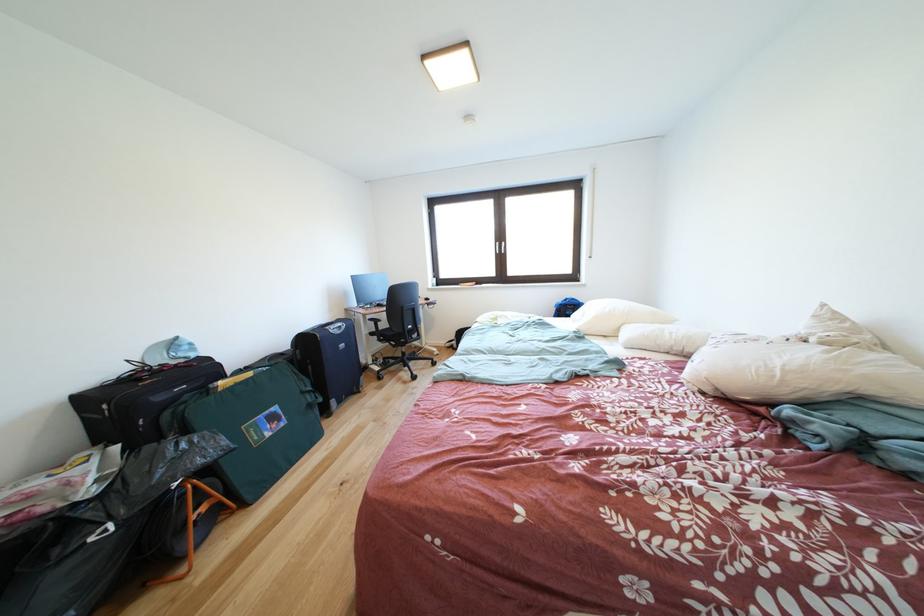
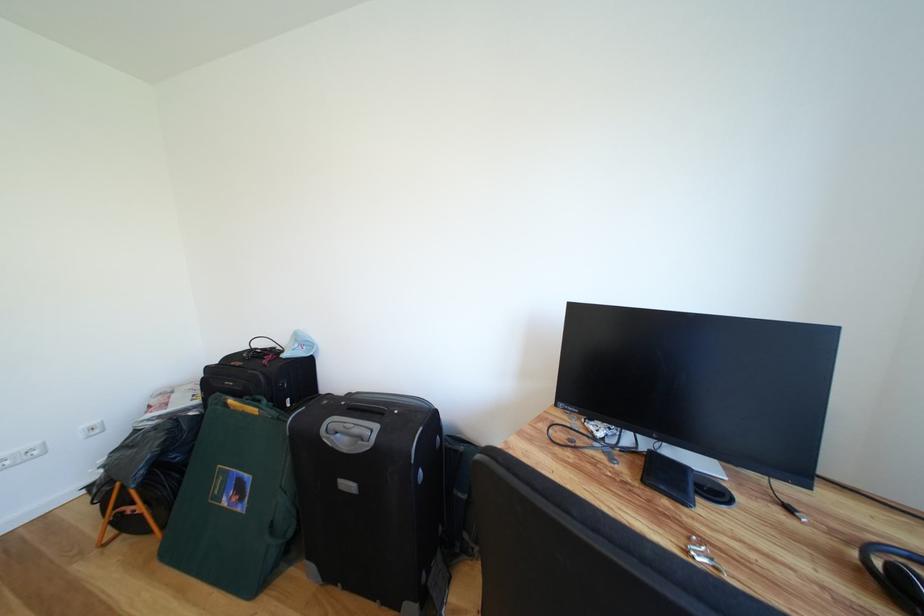
The point at [276,439] is marked in the first image. Where is the corresponding point in the second image?

(234, 506)